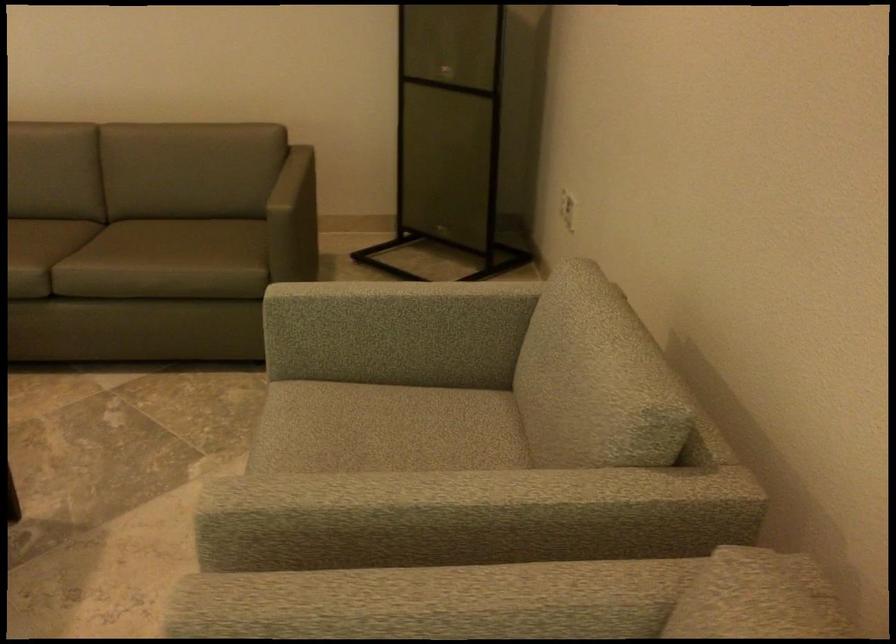
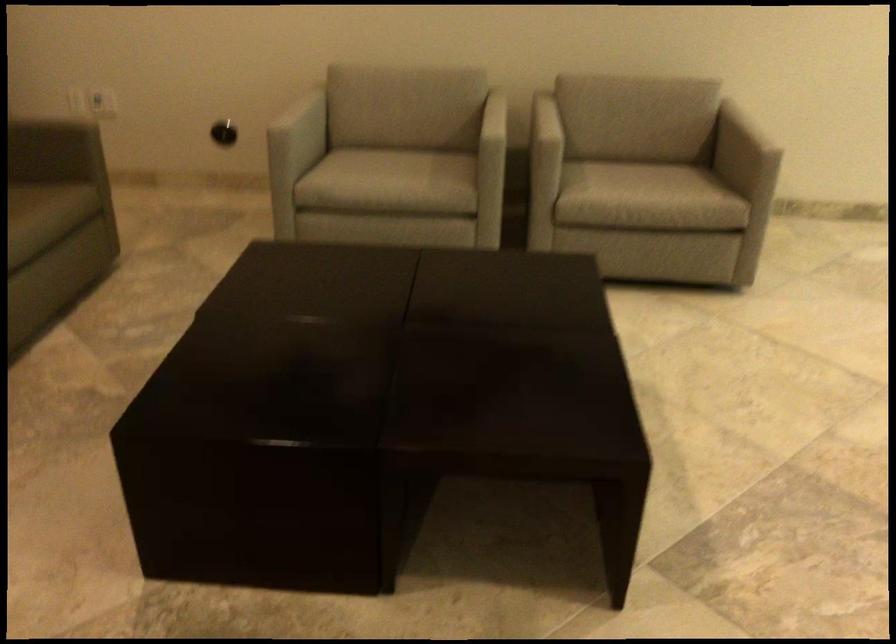
Locate, in the second image, the point that corresponds to (178,281) in the first image.

(36, 219)